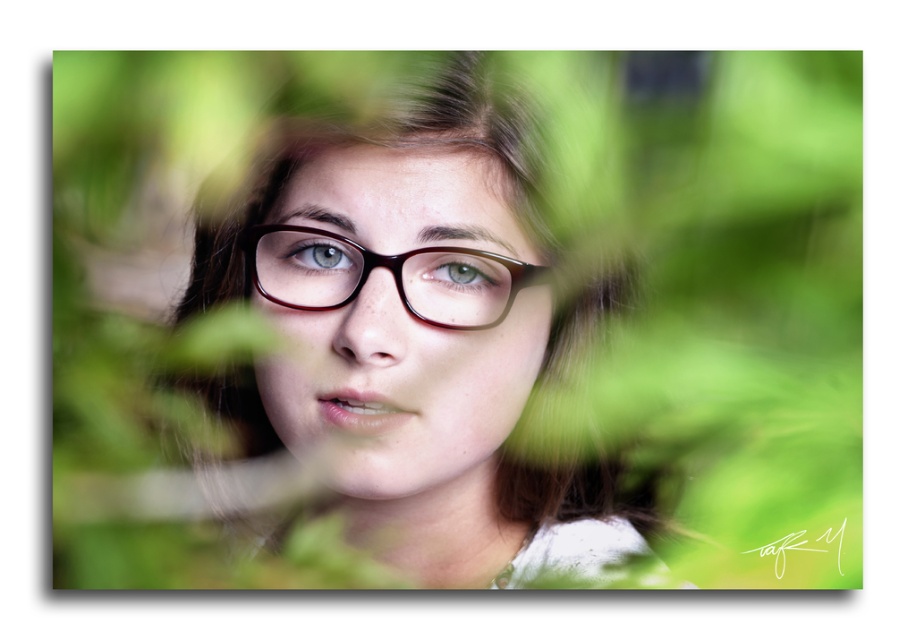
You are a photographer adjusting the lighting for a portrait. You notice two pairs of glasses on the subject, a matte brown glasses at center and a brown glossy glasses at center. Which pair is located to the right of the other?

The matte brown glasses at center is positioned on the right side of brown glossy glasses at center.

From the picture: You are a photographer holding a camera 14.89 inches away from the matte brown glasses at center. Can you capture the entire glasses in your shot without zooming in or out?

Yes, because the camera is positioned exactly 14.89 inches away from the matte brown glasses at center, which is the required distance to capture the entire glasses without needing to adjust the zoom.

You are a photographer adjusting the focus on a camera. You notice two pairs of glasses on the subject, the matte brown glasses at center and the brown glossy glasses at center. Which pair is closer to the camera lens?

The matte brown glasses at center is 2.84 inches closer to the camera lens than the brown glossy glasses at center, so it is the closer one.